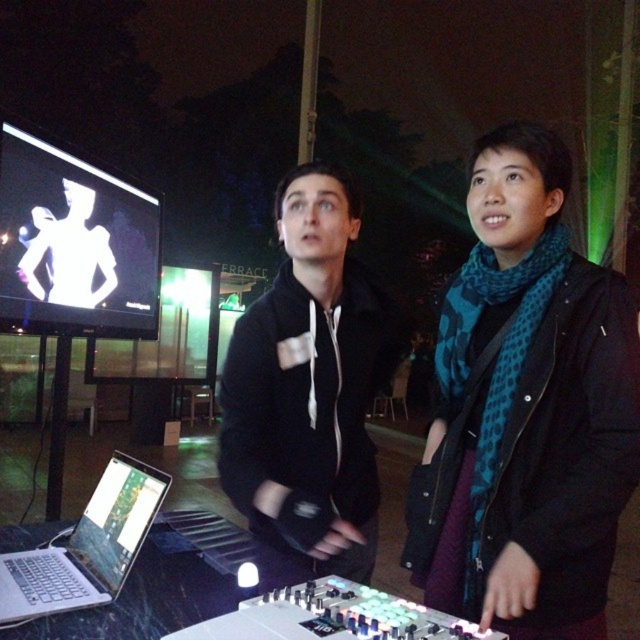
Question: Which of the following is the closest to the observer?

Choices:
 (A) silver metallic laptop at lower left
 (B) teal dotted scarf at center
 (C) black matte jacket at center

Answer: (B)

Question: Which object is the closest to the silver metallic laptop at lower left?

Choices:
 (A) teal dotted scarf at center
 (B) black matte jacket at center

Answer: (B)

Question: Which point is farther to the camera?

Choices:
 (A) metallic silver laptop at lower left
 (B) teal dotted scarf at center
 (C) black matte jacket at center
 (D) silver metallic laptop at lower left

Answer: (C)

Question: Is teal dotted scarf at center further to camera compared to metallic silver laptop at lower left?

Choices:
 (A) no
 (B) yes

Answer: (A)

Question: Does metallic silver laptop at lower left come in front of silver metallic laptop at lower left?

Choices:
 (A) no
 (B) yes

Answer: (B)

Question: Is teal dotted scarf at center above metallic silver laptop at lower left?

Choices:
 (A) no
 (B) yes

Answer: (B)